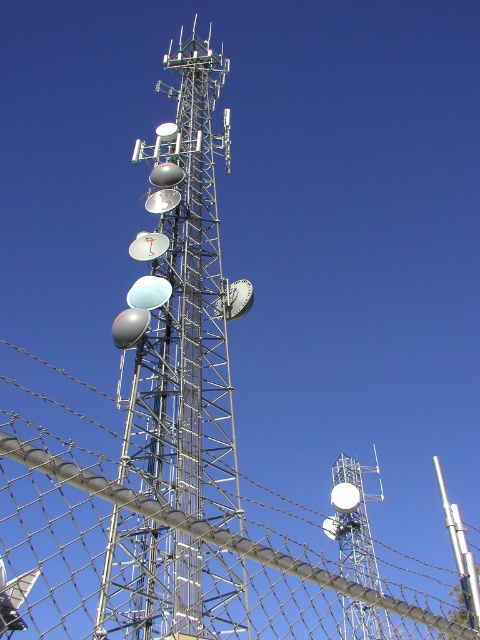
You are a delivery person trying to see if the metallic silver tower at center is visible from the other side of the wire mesh fence at center. Based on their heights, can you tell if the tower is visible over the fence?

The wire mesh fence at center is shorter than the metallic silver tower at center, so yes, the metallic silver tower at center is visible over the wire mesh fence at center.

You are standing at the base of the metallic silver tower at center. If you walk directly towards it, how far will you have to walk to reach the base?

The metallic silver tower at center is 51.21 meters away from the camera, so you would need to walk 51.21 meters to reach its base.

You are standing at the base of the telecommunications tower. You see two points marked on the tower, one at point [145,496] and the other at point [349,499]. Which point is closer to you?

Point [145,496] is closer to you because it is in front of point [349,499] on the tower.